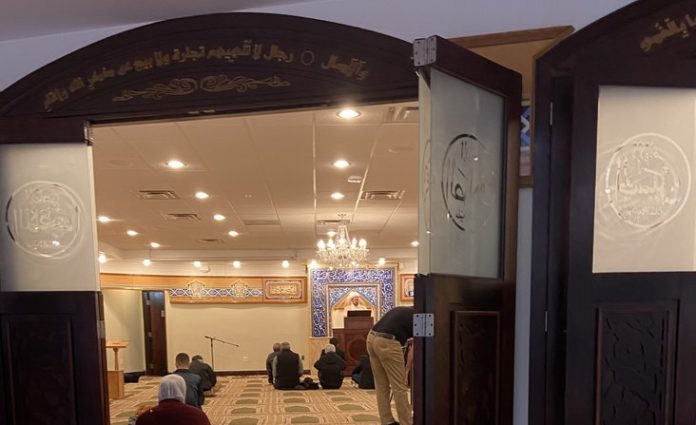
Locate an element on the screen. The height and width of the screenshot is (425, 696). open door is located at coordinates 158,328.